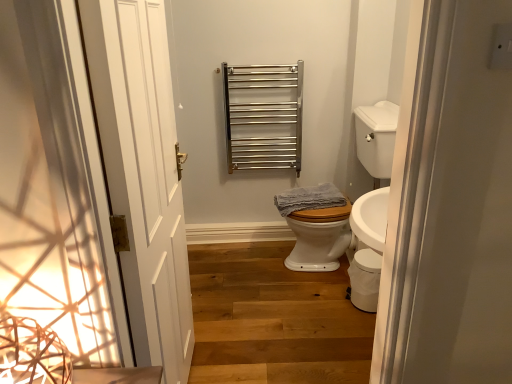
Question: Can you confirm if white glossy toilet bowl at lower right is positioned to the left of white glossy sink at right?

Choices:
 (A) no
 (B) yes

Answer: (A)

Question: Considering the relative sizes of white glossy toilet bowl at lower right and white glossy sink at right in the image provided, is white glossy toilet bowl at lower right thinner than white glossy sink at right?

Choices:
 (A) no
 (B) yes

Answer: (B)

Question: Is white glossy toilet bowl at lower right located outside white glossy sink at right?

Choices:
 (A) no
 (B) yes

Answer: (B)

Question: Does white glossy toilet bowl at lower right appear on the right side of white glossy sink at right?

Choices:
 (A) yes
 (B) no

Answer: (A)

Question: Is white glossy toilet bowl at lower right aimed at white glossy sink at right?

Choices:
 (A) yes
 (B) no

Answer: (B)

Question: From a real-world perspective, is white glossy toilet bowl at lower right below white glossy sink at right?

Choices:
 (A) yes
 (B) no

Answer: (A)

Question: Is white glossy sink at right in contact with polished stainless steel towel rack at upper center?

Choices:
 (A) no
 (B) yes

Answer: (A)

Question: Would you consider white glossy sink at right to be distant from polished stainless steel towel rack at upper center?

Choices:
 (A) yes
 (B) no

Answer: (B)

Question: Does white glossy sink at right have a lesser width compared to polished stainless steel towel rack at upper center?

Choices:
 (A) yes
 (B) no

Answer: (B)

Question: From the image's perspective, is white glossy sink at right below polished stainless steel towel rack at upper center?

Choices:
 (A) no
 (B) yes

Answer: (B)

Question: Is white glossy sink at right looking in the opposite direction of polished stainless steel towel rack at upper center?

Choices:
 (A) yes
 (B) no

Answer: (B)

Question: Is white glossy sink at right closer to camera compared to polished stainless steel towel rack at upper center?

Choices:
 (A) no
 (B) yes

Answer: (B)

Question: From a real-world perspective, does white glossy sink at right stand above blue textured towel at center?

Choices:
 (A) yes
 (B) no

Answer: (A)